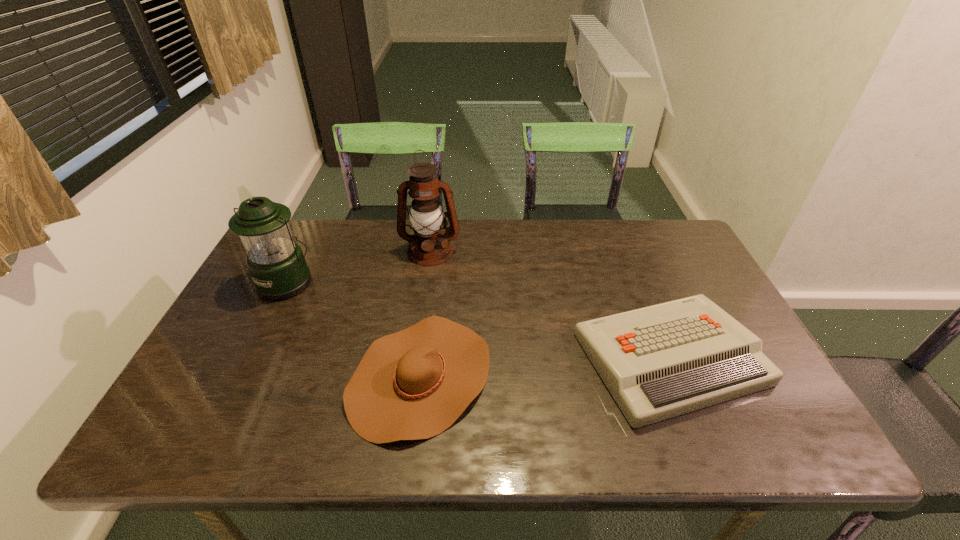
The height and width of the screenshot is (540, 960). I want to click on the tallest object, so click(x=429, y=246).

The height and width of the screenshot is (540, 960). In order to click on the right lantern in this screenshot , I will do `click(429, 246)`.

Image resolution: width=960 pixels, height=540 pixels. Identify the location of the leftmost object. coord(276,263).

Locate an element on the screen. the shorter lantern is located at coordinates click(276, 263).

You are a GUI agent. You are given a task and a screenshot of the screen. Output one action in this format:
    pyautogui.click(x=<x>, y=<y>)
    Task: Click on the rightmost object
    The image size is (960, 540).
    Given the screenshot: What is the action you would take?
    pyautogui.click(x=658, y=362)

Image resolution: width=960 pixels, height=540 pixels. What are the coordinates of `cowboy hat` in the screenshot? It's located at (414, 384).

Locate an element on the screen. The height and width of the screenshot is (540, 960). vacant space located on the side of the tallest object, there is a wick adjustment knob is located at coordinates (420, 330).

In order to click on free region located 0.300m on the front of the leftmost object in this screenshot , I will do `click(230, 393)`.

The width and height of the screenshot is (960, 540). I want to click on vacant area located on the back of the rightmost object, so click(639, 284).

Where is `free point located on the left of the cowboy hat`? free point located on the left of the cowboy hat is located at coordinates (220, 376).